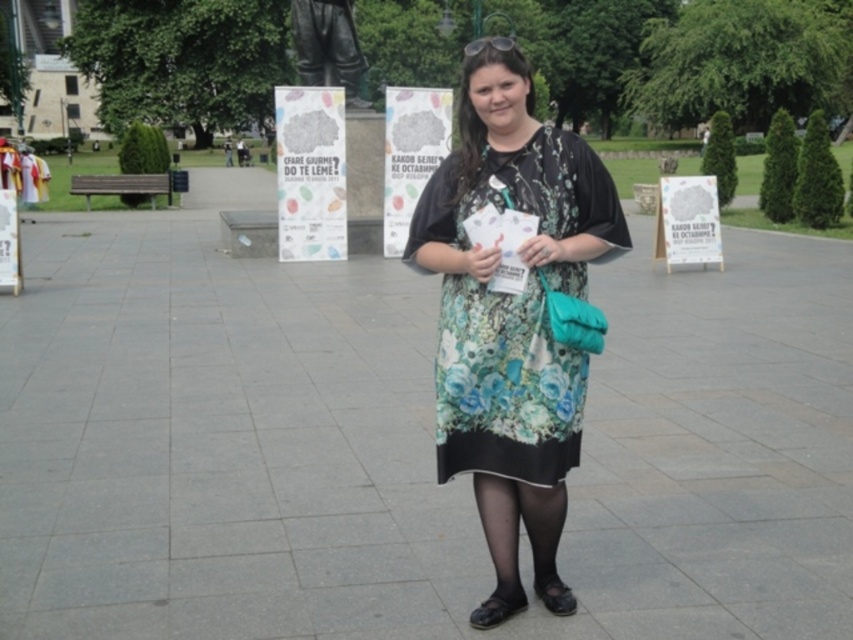
Between floral-patterned fabric dress at center and bronze statue at upper center, which one has more height?

floral-patterned fabric dress at center

Is floral-patterned fabric dress at center wider than bronze statue at upper center?

Yes.

Find the location of `floral-patterned fabric dress at center`. floral-patterned fabric dress at center is located at coordinates point(503,385).